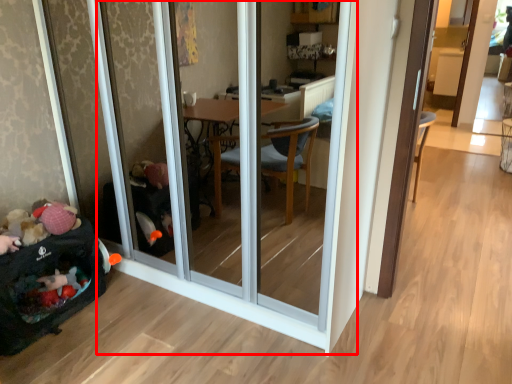
Question: From the image's perspective, considering the relative positions of screen door (annotated by the red box) and baby carriage in the image provided, where is screen door (annotated by the red box) located with respect to the staircase?

Choices:
 (A) above
 (B) below

Answer: (A)